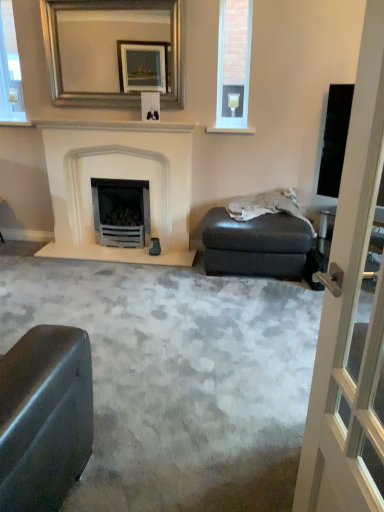
Question: Is white stone fireplace at center positioned in front of white glossy window frame at upper left?

Choices:
 (A) yes
 (B) no

Answer: (A)

Question: Can you confirm if white stone fireplace at center is positioned to the left of white glossy window frame at upper left?

Choices:
 (A) yes
 (B) no

Answer: (B)

Question: Is white stone fireplace at center taller than white glossy window frame at upper left?

Choices:
 (A) no
 (B) yes

Answer: (B)

Question: Is white stone fireplace at center shorter than white glossy window frame at upper left?

Choices:
 (A) yes
 (B) no

Answer: (B)

Question: Is white stone fireplace at center thinner than white glossy window frame at upper left?

Choices:
 (A) no
 (B) yes

Answer: (A)

Question: Can you confirm if white stone fireplace at center is smaller than white glossy window frame at upper left?

Choices:
 (A) no
 (B) yes

Answer: (A)

Question: Is white glossy window frame at upper left smaller than silver/golden-framed mirror at upper center?

Choices:
 (A) no
 (B) yes

Answer: (B)

Question: From the image's perspective, is white glossy window frame at upper left on top of silver/golden-framed mirror at upper center?

Choices:
 (A) yes
 (B) no

Answer: (A)

Question: Considering the relative positions of white glossy window frame at upper left and silver/golden-framed mirror at upper center in the image provided, is white glossy window frame at upper left to the right of silver/golden-framed mirror at upper center from the viewer's perspective?

Choices:
 (A) no
 (B) yes

Answer: (A)

Question: From a real-world perspective, is white glossy window frame at upper left below silver/golden-framed mirror at upper center?

Choices:
 (A) yes
 (B) no

Answer: (A)

Question: Is white glossy window frame at upper left next to silver/golden-framed mirror at upper center?

Choices:
 (A) yes
 (B) no

Answer: (B)

Question: Considering the relative sizes of white glossy window frame at upper left and silver/golden-framed mirror at upper center in the image provided, is white glossy window frame at upper left shorter than silver/golden-framed mirror at upper center?

Choices:
 (A) yes
 (B) no

Answer: (B)

Question: Is silver/golden-framed mirror at upper center thinner than white glossy window frame at upper left?

Choices:
 (A) yes
 (B) no

Answer: (B)